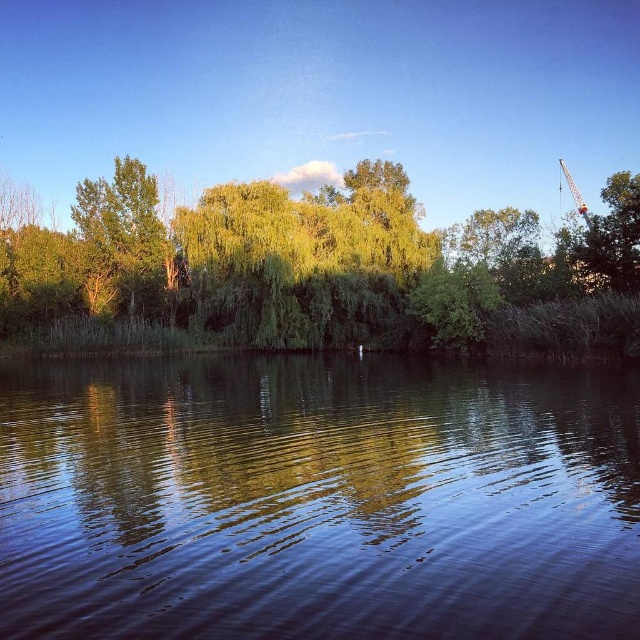
Image resolution: width=640 pixels, height=640 pixels. I want to click on green leafy tree at left, so click(124, 234).

How much distance is there between green leafy tree at left and metallic yellow crane at upper right?

They are 56.36 meters apart.

Find the location of a particular element. The width and height of the screenshot is (640, 640). green leafy tree at left is located at coordinates (124, 234).

Who is taller, smooth dark water at center or green leafy tree at left?

green leafy tree at left

Does point (612, 602) come in front of point (120, 257)?

Yes, it is in front of point (120, 257).

Is point (291, 572) positioned in front of point (129, 196)?

That is True.

Identify the location of smooth dark water at center. The width and height of the screenshot is (640, 640). (317, 499).

Is green leafy tree at center bigger than green leafy tree at left?

No.

Does point (588, 298) come closer to viewer compared to point (90, 253)?

Yes, it is.

Find the location of a particular element. green leafy tree at center is located at coordinates (320, 269).